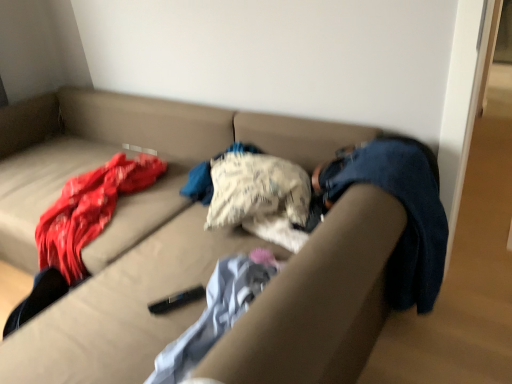
Question: From a real-world perspective, relative to beige fabric couch at center, is light blue textured blanket at center vertically above or below?

Choices:
 (A) below
 (B) above

Answer: (B)

Question: From the image's perspective, relative to beige fabric couch at center, is light blue textured blanket at center above or below?

Choices:
 (A) below
 (B) above

Answer: (A)

Question: In terms of height, does light blue textured blanket at center look taller or shorter compared to beige fabric couch at center?

Choices:
 (A) short
 (B) tall

Answer: (A)

Question: From a real-world perspective, is beige fabric couch at center above or below light blue textured blanket at center?

Choices:
 (A) below
 (B) above

Answer: (A)

Question: Relative to light blue textured blanket at center, is beige fabric couch at center in front or behind?

Choices:
 (A) behind
 (B) front

Answer: (B)

Question: Based on their sizes in the image, would you say beige fabric couch at center is bigger or smaller than light blue textured blanket at center?

Choices:
 (A) small
 (B) big

Answer: (B)

Question: Considering the relative positions of beige fabric couch at center and light blue textured blanket at center in the image provided, is beige fabric couch at center to the left or to the right of light blue textured blanket at center?

Choices:
 (A) right
 (B) left

Answer: (B)